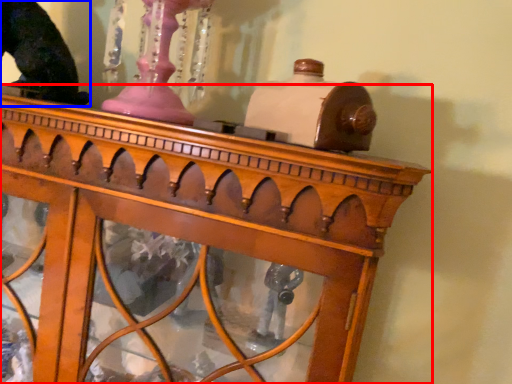
Question: Which of the following is the farthest to the observer, furniture (highlighted by a red box) or animal (highlighted by a blue box)?

Choices:
 (A) furniture
 (B) animal

Answer: (B)